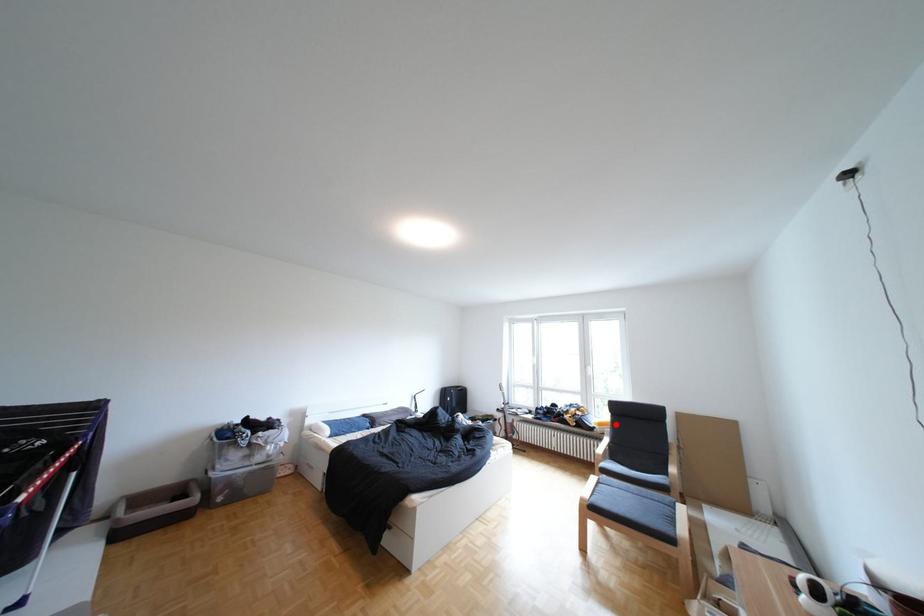
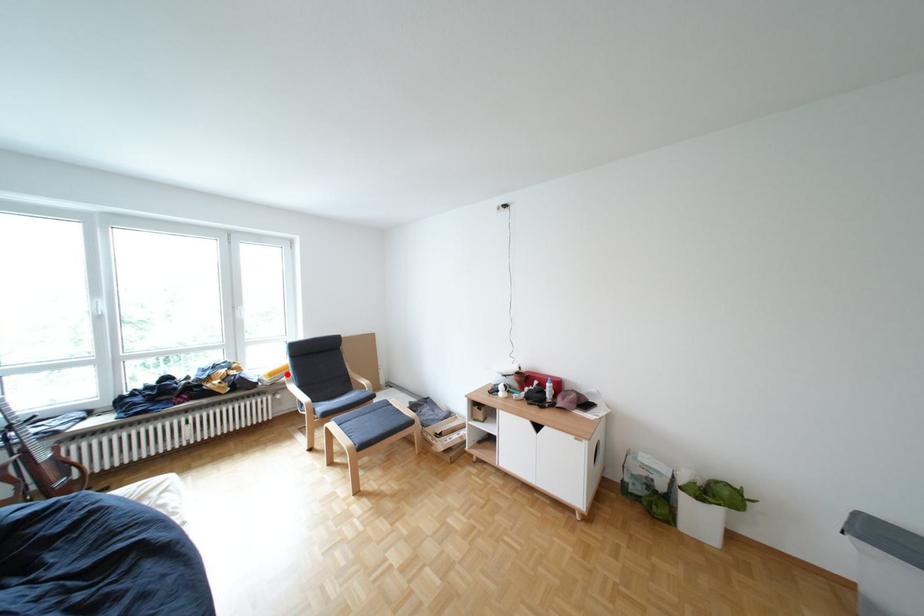
I am providing you with two images of the same scene from different viewpoints. A red point is marked on the first image and another point is marked on the second image. Is the red point in image1 aligned with the point shown in image2?

Yes